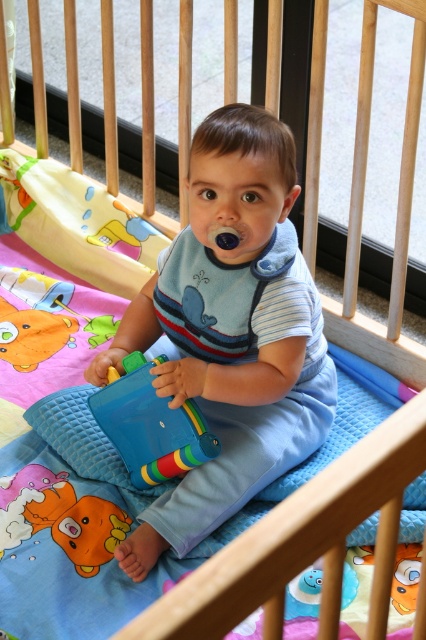
Can you confirm if blue matte toy at center is positioned to the left of blue plastic toy at center?

In fact, blue matte toy at center is to the right of blue plastic toy at center.

Who is more forward, (199, 488) or (104, 404)?

Positioned in front is point (199, 488).

This screenshot has width=426, height=640. Identify the location of blue matte toy at center. (230, 332).

The width and height of the screenshot is (426, 640). What do you see at coordinates (149, 426) in the screenshot?
I see `blue plastic toy at center` at bounding box center [149, 426].

Consider the image. Does blue plastic toy at center have a larger size compared to rubber duck at lower left?

Yes.

What do you see at coordinates (149, 426) in the screenshot?
I see `blue plastic toy at center` at bounding box center [149, 426].

Locate an element on the screen. The width and height of the screenshot is (426, 640). blue plastic toy at center is located at coordinates (149, 426).

Can you confirm if blue matte toy at center is positioned to the right of rubber duck at lower left?

Indeed, blue matte toy at center is positioned on the right side of rubber duck at lower left.

Is point (279, 221) in front of point (106, 525)?

Yes, point (279, 221) is in front of point (106, 525).

This screenshot has height=640, width=426. In order to click on blue matte toy at center in this screenshot , I will do `click(230, 332)`.